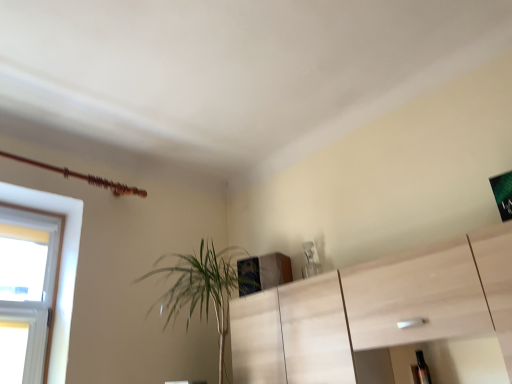
Describe the element at coordinates (422, 368) in the screenshot. I see `transparent plastic bottle at lower right` at that location.

Looking at this image, in order to face transparent plastic bottle at lower right, should I rotate leftwards or rightwards?

Rotate your view right by about 21.768°.

Measure the distance between transparent plastic bottle at lower right and camera.

transparent plastic bottle at lower right and camera are 1.92 meters apart from each other.

Image resolution: width=512 pixels, height=384 pixels. Identify the location of transparent plastic bottle at lower right. (422, 368).

This screenshot has height=384, width=512. What do you see at coordinates (203, 288) in the screenshot? I see `green leafy plant at center-left` at bounding box center [203, 288].

Find the location of a particular element. green leafy plant at center-left is located at coordinates (203, 288).

Find the location of `transparent plastic bottle at lower right`. transparent plastic bottle at lower right is located at coordinates (422, 368).

In the image, is green leafy plant at center-left on the left side or the right side of transparent plastic bottle at lower right?

green leafy plant at center-left is positioned on transparent plastic bottle at lower right's left side.

Is green leafy plant at center-left in front of or behind transparent plastic bottle at lower right in the image?

In the image, green leafy plant at center-left appears in front of transparent plastic bottle at lower right.

Between point (220, 382) and point (422, 366), which one is positioned in front?

Point (422, 366)

From the image's perspective, which is above, green leafy plant at center-left or transparent plastic bottle at lower right?

green leafy plant at center-left is shown above in the image.

From a real-world perspective, between green leafy plant at center-left and transparent plastic bottle at lower right, who is vertically higher?

green leafy plant at center-left, from a real-world perspective.

Which of these two, green leafy plant at center-left or transparent plastic bottle at lower right, is wider?

Wider between the two is green leafy plant at center-left.

Considering the relative sizes of green leafy plant at center-left and transparent plastic bottle at lower right in the image provided, is green leafy plant at center-left shorter than transparent plastic bottle at lower right?

Incorrect, the height of green leafy plant at center-left does not fall short of that of transparent plastic bottle at lower right.

Is green leafy plant at center-left bigger than transparent plastic bottle at lower right?

Correct, green leafy plant at center-left is larger in size than transparent plastic bottle at lower right.

Is green leafy plant at center-left inside or outside of transparent plastic bottle at lower right?

green leafy plant at center-left is located beyond the bounds of transparent plastic bottle at lower right.

Is the surface of green leafy plant at center-left in direct contact with transparent plastic bottle at lower right?

No, green leafy plant at center-left is not making contact with transparent plastic bottle at lower right.

Is green leafy plant at center-left positioned with its back to transparent plastic bottle at lower right?

No, transparent plastic bottle at lower right is not at the back of green leafy plant at center-left.

What's the angular difference between green leafy plant at center-left and transparent plastic bottle at lower right's facing directions?

green leafy plant at center-left and transparent plastic bottle at lower right are facing 0.259 degrees away from each other.

Consider the image. Measure the distance from green leafy plant at center-left to transparent plastic bottle at lower right.

green leafy plant at center-left is 1.21 meters away from transparent plastic bottle at lower right.

Find the location of a particular element. Image resolution: width=512 pixels, height=384 pixels. bottle below the green leafy plant at center-left (from the image's perspective) is located at coordinates (422, 368).

Which object is positioned more to the right, transparent plastic bottle at lower right or green leafy plant at center-left?

transparent plastic bottle at lower right.

Based on the photo, does transparent plastic bottle at lower right come in front of green leafy plant at center-left?

No, it is behind green leafy plant at center-left.

Does point (418, 356) appear closer or farther from the camera than point (256, 263)?

Point (418, 356) is positioned closer to the camera compared to point (256, 263).

From the image's perspective, is transparent plastic bottle at lower right above or below green leafy plant at center-left?

Based on their image positions, transparent plastic bottle at lower right is located beneath green leafy plant at center-left.

From a real-world perspective, who is located lower, transparent plastic bottle at lower right or green leafy plant at center-left?

transparent plastic bottle at lower right.

Consider the image. Which object is wider, transparent plastic bottle at lower right or green leafy plant at center-left?

Wider between the two is green leafy plant at center-left.

Between transparent plastic bottle at lower right and green leafy plant at center-left, which one has more height?

green leafy plant at center-left.

Can you confirm if transparent plastic bottle at lower right is smaller than green leafy plant at center-left?

Yes, transparent plastic bottle at lower right is smaller than green leafy plant at center-left.

Is transparent plastic bottle at lower right spatially inside green leafy plant at center-left, or outside of it?

transparent plastic bottle at lower right cannot be found inside green leafy plant at center-left.

Can you see transparent plastic bottle at lower right touching green leafy plant at center-left?

No, transparent plastic bottle at lower right is not in contact with green leafy plant at center-left.

Is transparent plastic bottle at lower right looking in the opposite direction of green leafy plant at center-left?

No, green leafy plant at center-left is not at the back of transparent plastic bottle at lower right.

How different are the orientations of transparent plastic bottle at lower right and green leafy plant at center-left in degrees?

They differ by 0.259 degrees in their facing directions.

In the scene shown: How much distance is there between transparent plastic bottle at lower right and green leafy plant at center-left?

1.21 meters.

Find the location of `bottle located on the right of green leafy plant at center-left`. bottle located on the right of green leafy plant at center-left is located at coordinates (422, 368).

Find the location of `houseplant in front of the transparent plastic bottle at lower right`. houseplant in front of the transparent plastic bottle at lower right is located at coordinates (203, 288).

Find the location of a particular element. The width and height of the screenshot is (512, 384). houseplant that is above the transparent plastic bottle at lower right (from the image's perspective) is located at coordinates (203, 288).